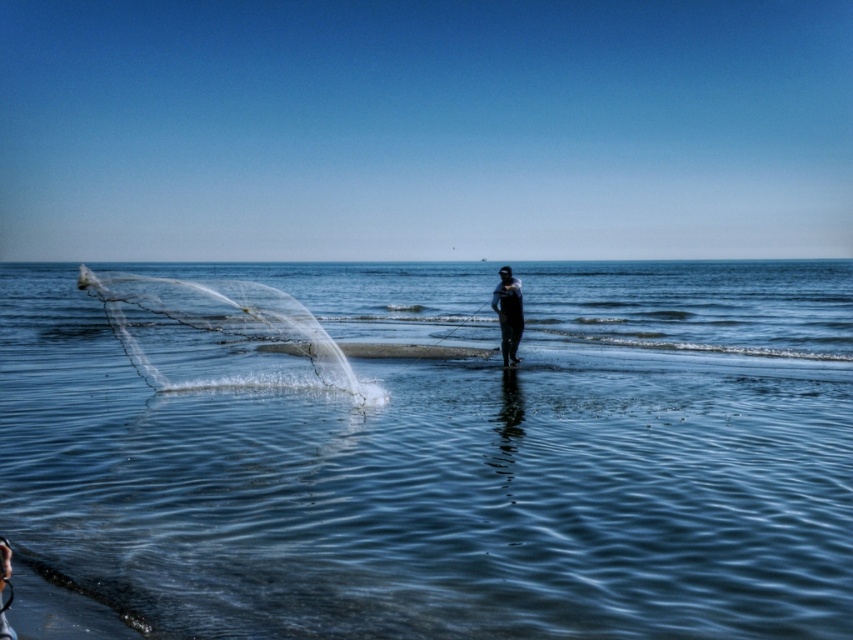
Question: Which point appears farthest from the camera in this image?

Choices:
 (A) (428, 474)
 (B) (515, 356)

Answer: (B)

Question: Which of the following is the closest to the observer?

Choices:
 (A) transparent nylon net at left
 (B) clear water at center
 (C) black matte wetsuit at center

Answer: (B)

Question: Which object appears farthest from the camera in this image?

Choices:
 (A) transparent nylon net at left
 (B) black matte wetsuit at center
 (C) clear water at center

Answer: (B)

Question: Observing the image, what is the correct spatial positioning of transparent nylon net at left in reference to black matte wetsuit at center?

Choices:
 (A) left
 (B) right

Answer: (A)

Question: Is clear water at center below black matte wetsuit at center?

Choices:
 (A) yes
 (B) no

Answer: (B)

Question: Is transparent nylon net at left thinner than black matte wetsuit at center?

Choices:
 (A) yes
 (B) no

Answer: (B)